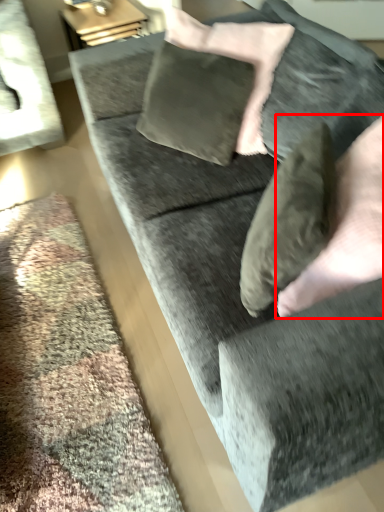
Question: Considering the relative positions of hand (annotated by the red box) and pillow in the image provided, where is hand (annotated by the red box) located with respect to the staircase?

Choices:
 (A) right
 (B) left

Answer: (A)